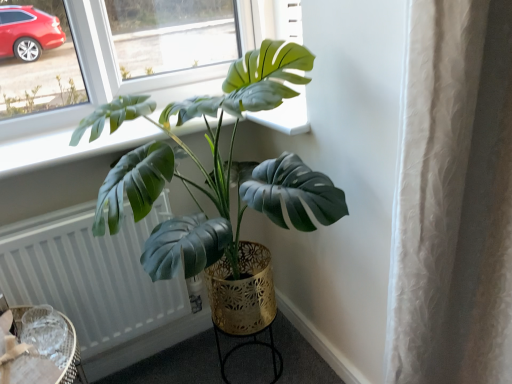
Question: Which is correct: gold metallic round table at lower center, which is counted as the second round table, starting from the front, is inside white textured radiator at lower left, or outside of it?

Choices:
 (A) inside
 (B) outside

Answer: (B)

Question: In terms of size, does gold metallic round table at lower center, arranged as the first round table when viewed from the right, appear bigger or smaller than white textured radiator at lower left?

Choices:
 (A) small
 (B) big

Answer: (A)

Question: Based on their relative distances, which object is farther from the green matte plant at center?

Choices:
 (A) white textured radiator at lower left
 (B) woven rattan table at lower left, placed as the 2th round table when sorted from back to front
 (C) gold metallic round table at lower center, which is counted as the second round table, starting from the front

Answer: (C)

Question: Which of these objects is positioned closest to the white textured radiator at lower left?

Choices:
 (A) green matte plant at center
 (B) gold metallic round table at lower center, marked as the first round table in a back-to-front arrangement
 (C) woven rattan table at lower left, acting as the second round table starting from the right

Answer: (C)